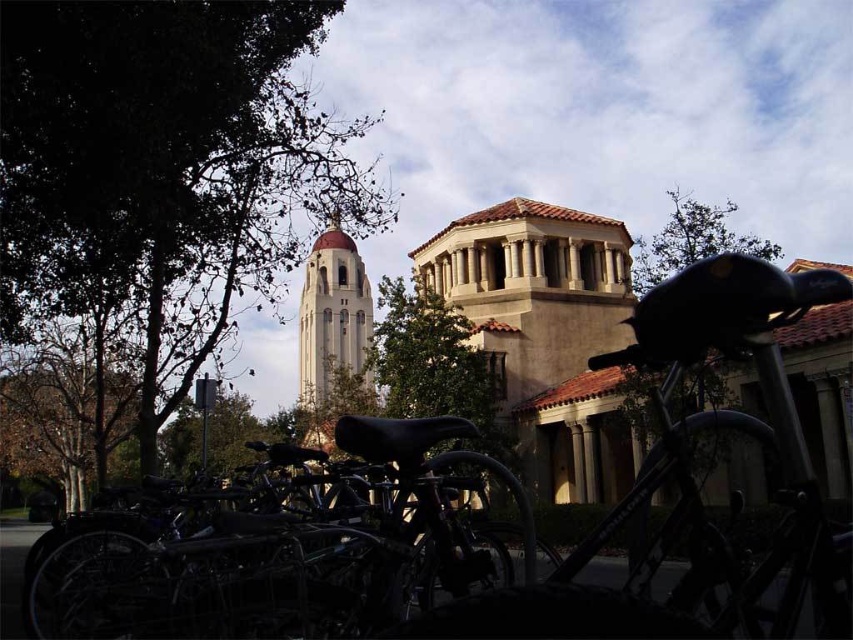
Can you confirm if green leafy tree at upper left is bigger than green leafy tree at center?

Indeed, green leafy tree at upper left has a larger size compared to green leafy tree at center.

Does green leafy tree at upper left have a greater width compared to green leafy tree at center?

Indeed, green leafy tree at upper left has a greater width compared to green leafy tree at center.

What do you see at coordinates (163, 168) in the screenshot? The height and width of the screenshot is (640, 853). I see `green leafy tree at upper left` at bounding box center [163, 168].

I want to click on green leafy tree at upper left, so click(163, 168).

Can you confirm if shiny black bicycle at center is smaller than shiny black bicycle at lower center?

No, shiny black bicycle at center is not smaller than shiny black bicycle at lower center.

Locate an element on the screen. shiny black bicycle at center is located at coordinates (514, 586).

What are the coordinates of `shiny black bicycle at center` in the screenshot? It's located at (514, 586).

The width and height of the screenshot is (853, 640). In order to click on shiny black bicycle at lower center in this screenshot , I will do `click(279, 554)`.

Between shiny black bicycle at lower center and green leafy tree at upper right, which one is positioned higher?

green leafy tree at upper right is higher up.

Image resolution: width=853 pixels, height=640 pixels. I want to click on shiny black bicycle at lower center, so [x=279, y=554].